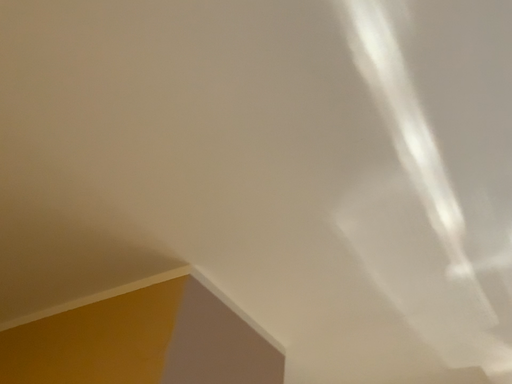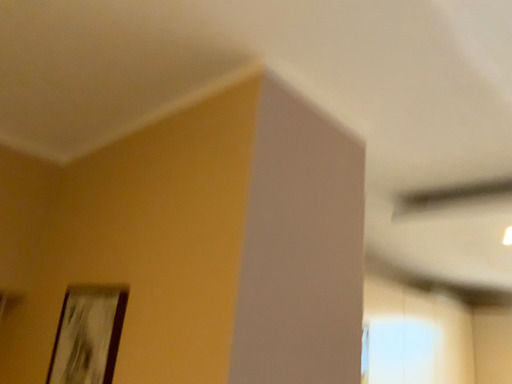
Question: How did the camera likely rotate when shooting the video?

Choices:
 (A) rotated upward
 (B) rotated downward

Answer: (B)